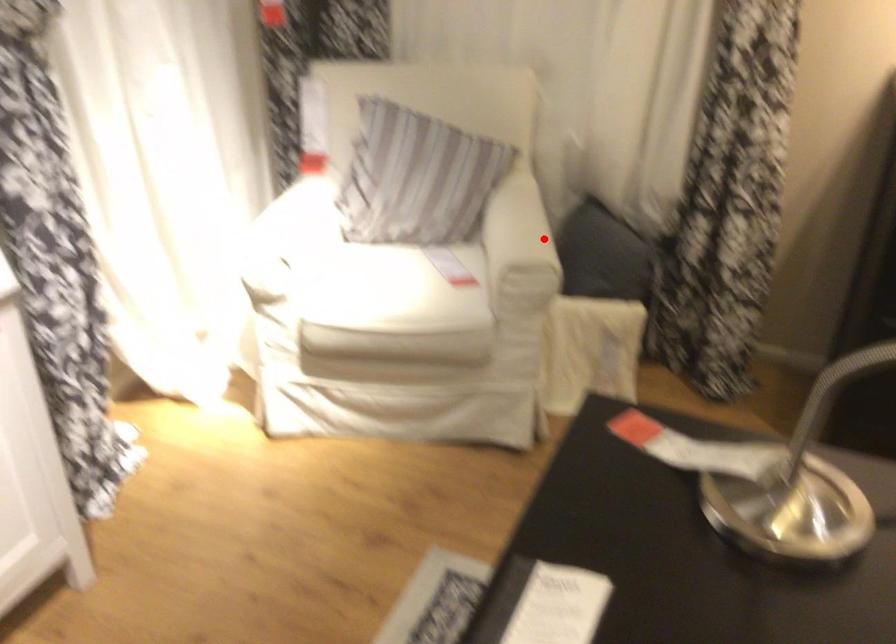
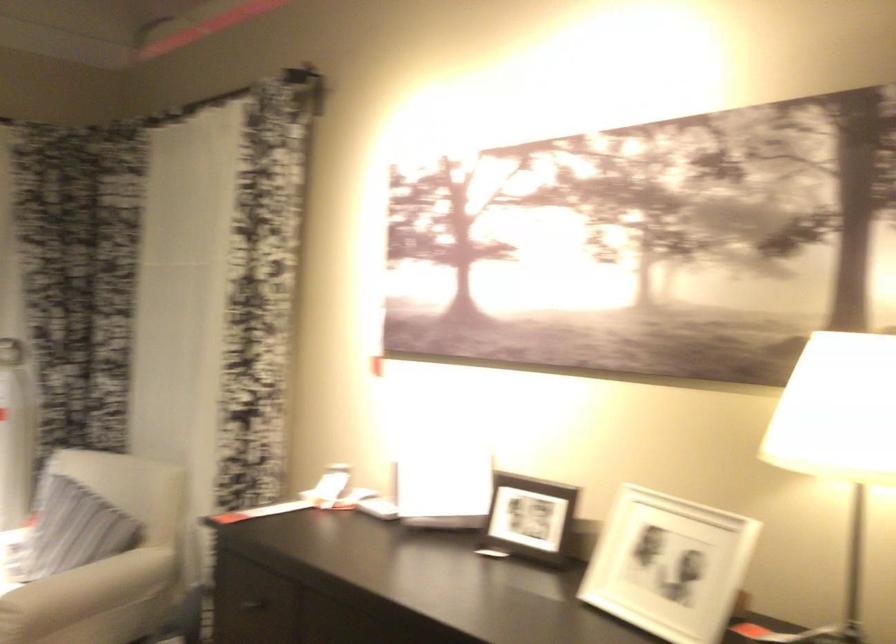
Question: I am providing you with two images of the same scene from different viewpoints. Image1 has a red point marked. In image2, the corresponding 3D location appears at what relative position? Reply with the corresponding letter.

Choices:
 (A) Closer
 (B) Farther

Answer: (B)